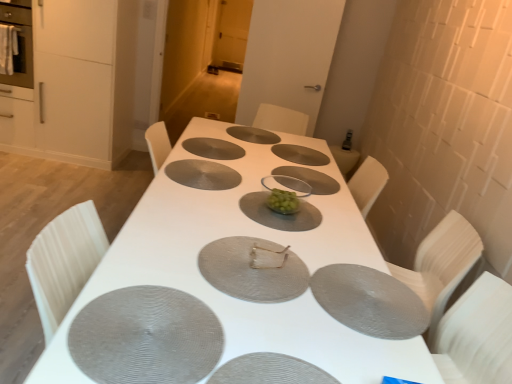
You are a GUI agent. You are given a task and a screenshot of the screen. Output one action in this format:
    pyautogui.click(x=<x>, y=<y>)
    Task: Click on the vacant area that lies between gray textured placemat at center, placed as the 7th pizza pan when sorted from back to front, and silver textured pizza pan at center, the 1th pizza pan in the back-to-front sequence
    
    Given the screenshot: What is the action you would take?
    pyautogui.click(x=209, y=190)